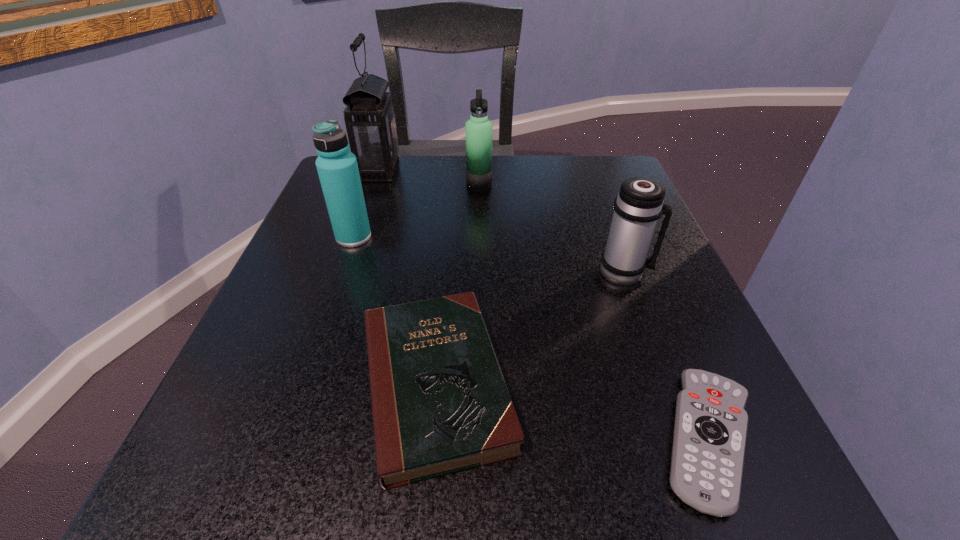
Where is `object that can be found as the second closest to the shortest thermos bottle`? The image size is (960, 540). object that can be found as the second closest to the shortest thermos bottle is located at coordinates (710, 430).

At what (x,y) coordinates should I click in order to perform the action: click on the third closest object to the Bible. Please return your answer as a coordinate pair (x, y). This screenshot has width=960, height=540. Looking at the image, I should click on (639, 204).

Select which thermos bottle appears as the second closest to the lantern. Please provide its 2D coordinates. Your answer should be formatted as a tuple, i.e. [(x, y)], where the tuple contains the x and y coordinates of a point satisfying the conditions above.

[(337, 167)]

Identify the location of thermos bottle object that ranks as the closest to the third shortest object. (479, 129).

Where is `free location that satisfies the following two spatial constraints: 1. on the front-facing side of the shortest object; 2. on the left side of the tallest object`? This screenshot has width=960, height=540. free location that satisfies the following two spatial constraints: 1. on the front-facing side of the shortest object; 2. on the left side of the tallest object is located at coordinates (286, 438).

Image resolution: width=960 pixels, height=540 pixels. In order to click on vacant space that satisfies the following two spatial constraints: 1. on the front-facing side of the lantern; 2. on the back side of the shortest object in this screenshot , I will do `click(286, 438)`.

This screenshot has width=960, height=540. What are the coordinates of `free space that satisfies the following two spatial constraints: 1. on the front side of the remote control; 2. on the right side of the second shortest object` in the screenshot? It's located at click(431, 438).

You are a GUI agent. You are given a task and a screenshot of the screen. Output one action in this format:
    pyautogui.click(x=<x>, y=<y>)
    Task: Click on the free region that satisfies the following two spatial constraints: 1. on the side with the handle of the shortest thermos bottle; 2. on the right side of the shortest object
    The image size is (960, 540).
    Given the screenshot: What is the action you would take?
    pyautogui.click(x=685, y=438)